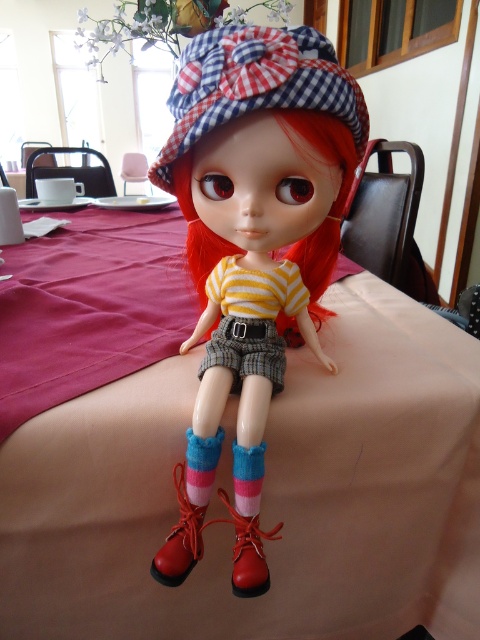
Does point (251, 560) come closer to viewer compared to point (271, 349)?

Yes.

Does matte plastic doll at center appear on the right side of yellow striped fabric shorts at center?

Correct, you'll find matte plastic doll at center to the right of yellow striped fabric shorts at center.

Where is `matte plastic doll at center`? matte plastic doll at center is located at coordinates (259, 202).

Can you confirm if beige fabric table at center is bigger than yellow striped fabric shorts at center?

Yes, beige fabric table at center is bigger than yellow striped fabric shorts at center.

Does beige fabric table at center appear on the left side of yellow striped fabric shorts at center?

Yes, beige fabric table at center is to the left of yellow striped fabric shorts at center.

Is point (275, 406) farther from camera compared to point (267, 320)?

No.

Identify the location of beige fabric table at center. The height and width of the screenshot is (640, 480). (265, 456).

Consider the image. Is matte plastic doll at center bigger than knitted pink and blue socks at lower center?

Yes.

Which of these two, matte plastic doll at center or knitted pink and blue socks at lower center, stands shorter?

Standing shorter between the two is knitted pink and blue socks at lower center.

Who is more distant from viewer, (x=333, y=221) or (x=187, y=493)?

Positioned behind is point (x=333, y=221).

Identify the location of matte plastic doll at center. The image size is (480, 640). (259, 202).